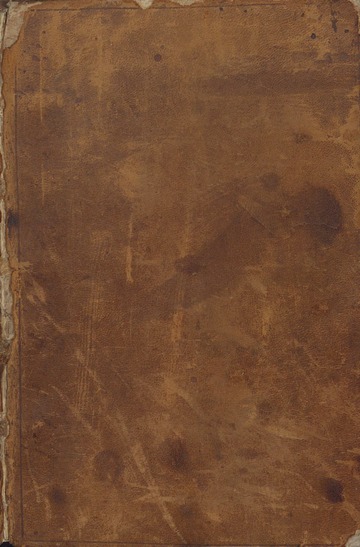
Where is `book spine`? book spine is located at coordinates (11, 410).